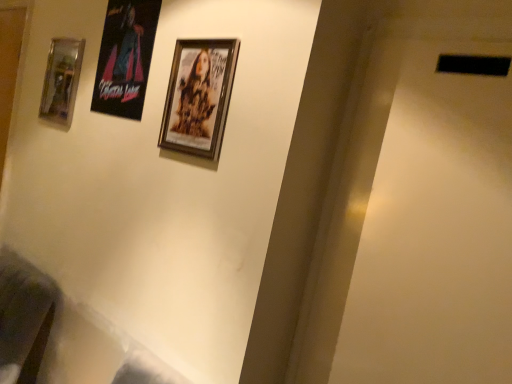
Question: Considering their positions, is wooden framed poster at center, the second picture frame in the back-to-front sequence, located in front of or behind metallic glass picture frame at left, the second picture frame from the front?

Choices:
 (A) behind
 (B) front

Answer: (B)

Question: Is wooden framed poster at center, the 1th picture frame viewed from the right, wider or thinner than metallic glass picture frame at left, which appears as the 2th picture frame when viewed from the right?

Choices:
 (A) wide
 (B) thin

Answer: (B)

Question: In terms of size, does wooden framed poster at center, arranged as the second picture frame when viewed from the left, appear bigger or smaller than metallic glass picture frame at left, the second picture frame from the front?

Choices:
 (A) big
 (B) small

Answer: (B)

Question: From a real-world perspective, is metallic glass picture frame at left, which appears as the 2th picture frame when viewed from the right, positioned above or below wooden framed poster at center, the second picture frame in the back-to-front sequence?

Choices:
 (A) below
 (B) above

Answer: (B)

Question: Is point (53, 77) closer or farther from the camera than point (214, 82)?

Choices:
 (A) farther
 (B) closer

Answer: (A)

Question: Is metallic glass picture frame at left, placed as the first picture frame when sorted from back to front, wider or thinner than wooden framed poster at center, the second picture frame in the back-to-front sequence?

Choices:
 (A) thin
 (B) wide

Answer: (B)

Question: From the image's perspective, is metallic glass picture frame at left, the second picture frame from the front, located above or below wooden framed poster at center, arranged as the second picture frame when viewed from the left?

Choices:
 (A) below
 (B) above

Answer: (B)